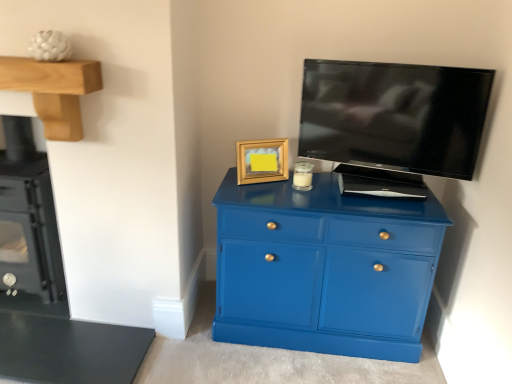
Question: Can you confirm if glossy blue cabinet at center is positioned to the left of wooden mantel at upper left?

Choices:
 (A) yes
 (B) no

Answer: (B)

Question: Is glossy blue cabinet at center in front of wooden mantel at upper left?

Choices:
 (A) no
 (B) yes

Answer: (A)

Question: Is glossy blue cabinet at center not near wooden mantel at upper left?

Choices:
 (A) no
 (B) yes

Answer: (A)

Question: From a real-world perspective, is glossy blue cabinet at center positioned over wooden mantel at upper left based on gravity?

Choices:
 (A) no
 (B) yes

Answer: (A)

Question: Could wooden mantel at upper left be considered to be inside glossy blue cabinet at center?

Choices:
 (A) no
 (B) yes

Answer: (A)

Question: From the image's perspective, is glossy blue cabinet at center located above wooden mantel at upper left?

Choices:
 (A) no
 (B) yes

Answer: (A)

Question: From the image's perspective, is black glass stove at left on top of black glossy tv at upper right?

Choices:
 (A) yes
 (B) no

Answer: (B)

Question: Does black glass stove at left appear on the right side of black glossy tv at upper right?

Choices:
 (A) yes
 (B) no

Answer: (B)

Question: Is black glass stove at left positioned with its back to black glossy tv at upper right?

Choices:
 (A) no
 (B) yes

Answer: (A)

Question: Is black glass stove at left outside black glossy tv at upper right?

Choices:
 (A) no
 (B) yes

Answer: (B)

Question: Is black glass stove at left positioned before black glossy tv at upper right?

Choices:
 (A) yes
 (B) no

Answer: (B)

Question: From a real-world perspective, is black glass stove at left under black glossy tv at upper right?

Choices:
 (A) no
 (B) yes

Answer: (B)

Question: From a real-world perspective, does black glass stove at left stand above gold wooden picture frame at upper center?

Choices:
 (A) yes
 (B) no

Answer: (B)